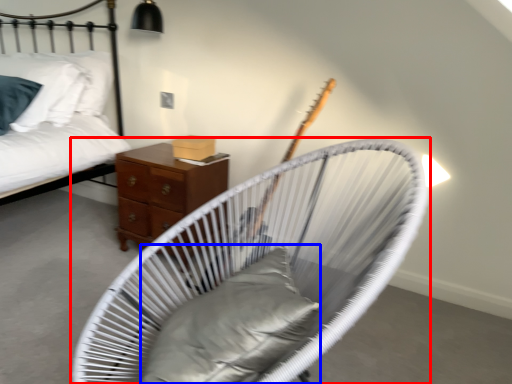
Question: Which object is closer to the camera taking this photo, furniture (highlighted by a red box) or pillow (highlighted by a blue box)?

Choices:
 (A) furniture
 (B) pillow

Answer: (A)